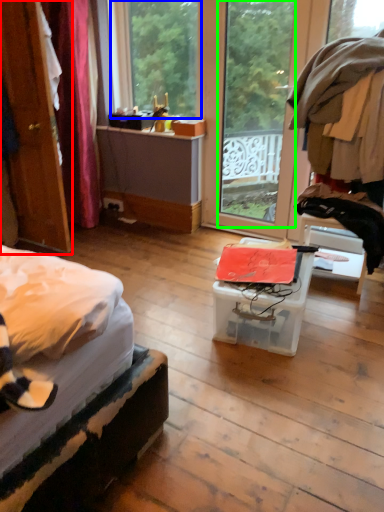
Question: Considering the real-world distances, which object is farthest from door (highlighted by a red box)? window (highlighted by a blue box) or glass door (highlighted by a green box)?

Choices:
 (A) window
 (B) glass door

Answer: (B)